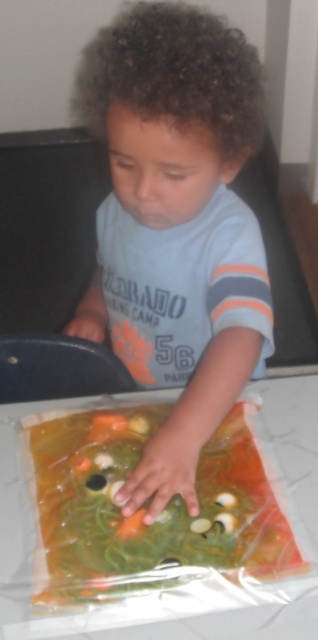
Question: Is matte blue shirt at center bigger than translucent plastic bag at center?

Choices:
 (A) no
 (B) yes

Answer: (B)

Question: Can you confirm if matte blue shirt at center is wider than translucent plastic bag at center?

Choices:
 (A) no
 (B) yes

Answer: (A)

Question: Which point is farther from the camera taking this photo?

Choices:
 (A) (219, 381)
 (B) (87, 522)

Answer: (A)

Question: Which of the following is the farthest from the observer?

Choices:
 (A) translucent plastic bag at center
 (B) matte blue shirt at center

Answer: (B)

Question: Is matte blue shirt at center thinner than translucent plastic bag at center?

Choices:
 (A) no
 (B) yes

Answer: (B)